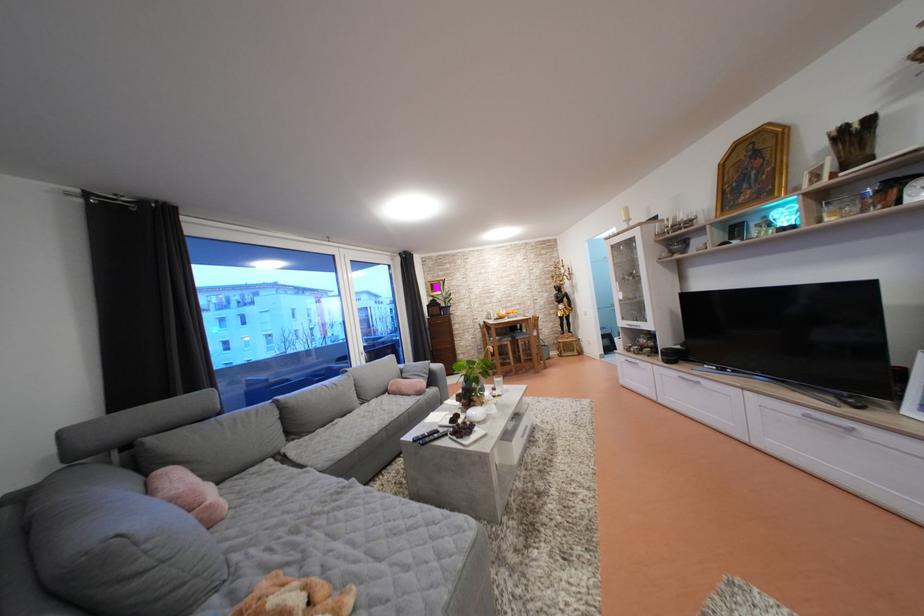
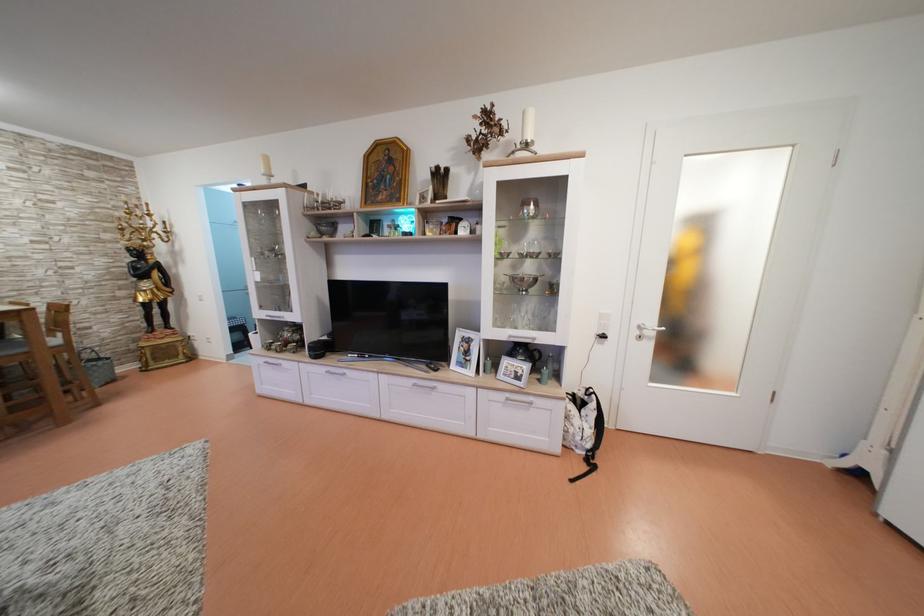
The point at (688,379) is marked in the first image. Where is the corresponding point in the second image?

(335, 374)